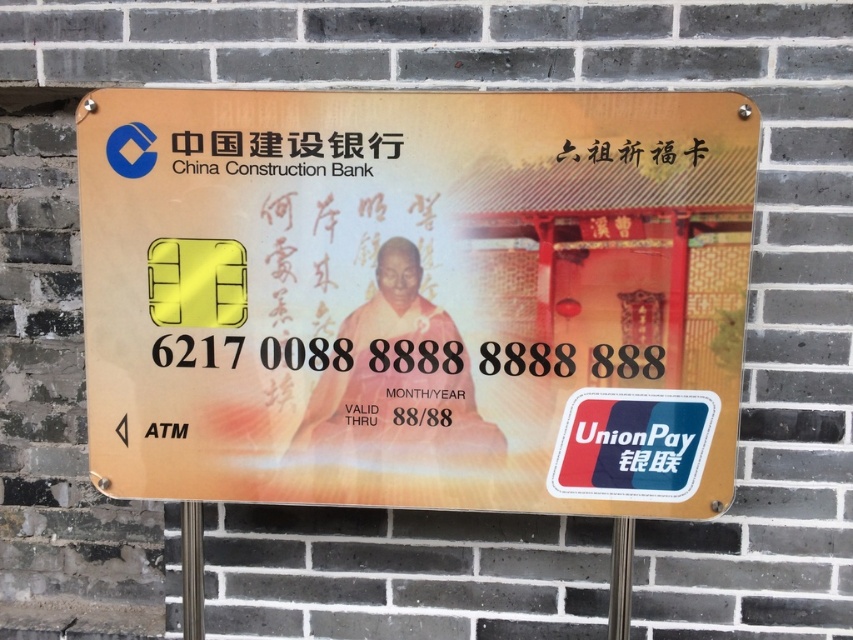
You are a customer at China Construction Bank and want to locate the white glossy unionpay sticker at center. Where should you look relative to the black plastic text at upper center?

The white glossy unionpay sticker at center is positioned under the black plastic text at upper center, so you should look below the black plastic text at upper center to find it.

You are a customer at China Construction Bank and want to locate the white glossy unionpay sticker at center and the metallic pole at center. Which object is smaller in size?

The white glossy unionpay sticker at center is smaller than the metallic pole at center.

You are a bank employee who needs to place a new 30 cm wide advertisement poster between the white glossy unionpay sticker at center and the black plastic text at upper center on the signboard. Can you fit the poster without overlapping either object?

The distance between the white glossy unionpay sticker at center and the black plastic text at upper center is 36.95 centimeters. Since the poster is 30 cm wide, there is enough space to place it between them without overlapping either object.